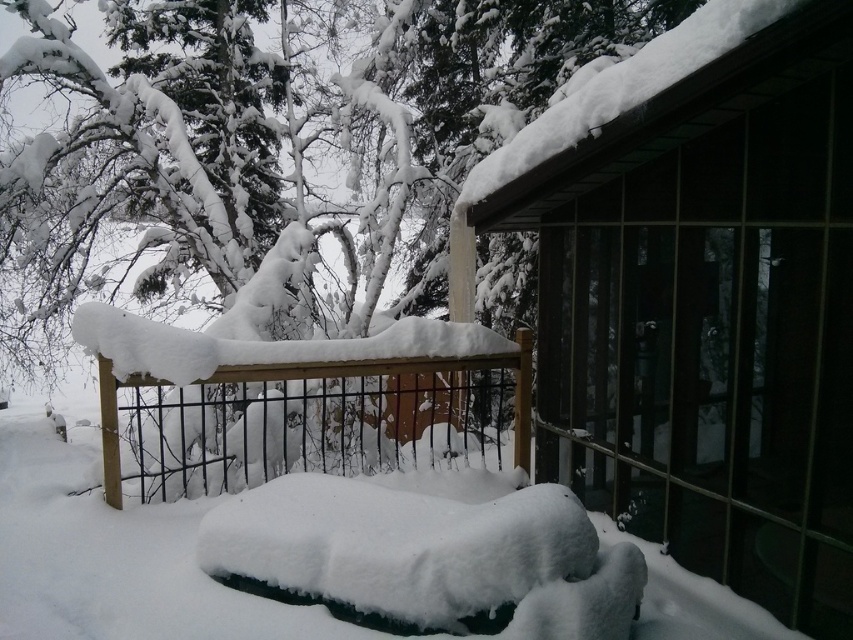
Does point (691, 480) come farther from viewer compared to point (108, 429)?

No, it is not.

At what (x,y) coordinates should I click in order to perform the action: click on wooden cabin at upper right. Please return your answer as a coordinate pair (x, y). This screenshot has width=853, height=640. Looking at the image, I should click on (701, 298).